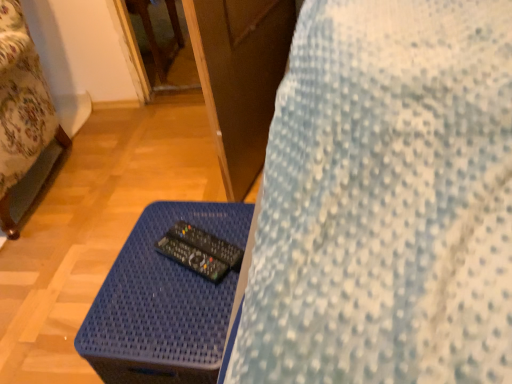
I want to click on free space to the back side of black plastic remote at center, placed as the 1th control when sorted from bottom to top, so click(x=184, y=220).